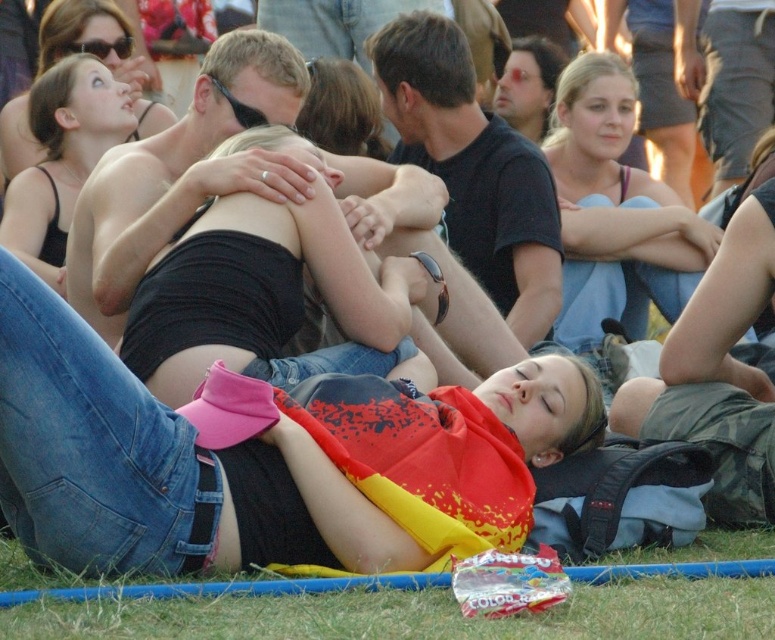
Between matte black tank top at center and matte black tank top at upper left, which one appears on the right side from the viewer's perspective?

Positioned to the right is matte black tank top at center.

Who is shorter, matte black tank top at center or matte black tank top at upper left?

With less height is matte black tank top at upper left.

Which is behind, point (598, 305) or point (135, 134)?

The point (135, 134) is behind.

Identify the location of matte black tank top at center. The height and width of the screenshot is (640, 775). (615, 211).

Does black matte tank top at center have a lesser width compared to matte black tank top at upper left?

No.

In the scene shown: Is black matte tank top at center above matte black tank top at upper left?

Incorrect, black matte tank top at center is not positioned above matte black tank top at upper left.

Which is in front, point (240, 241) or point (88, 4)?

Point (240, 241) is more forward.

Identify the location of black matte tank top at center. (270, 298).

Does yellow and red fabric at center have a larger size compared to green grass at lower center?

Indeed, yellow and red fabric at center has a larger size compared to green grass at lower center.

Between yellow and red fabric at center and green grass at lower center, which one has more height?

With more height is yellow and red fabric at center.

Locate an element on the screen. This screenshot has height=640, width=775. yellow and red fabric at center is located at coordinates (267, 460).